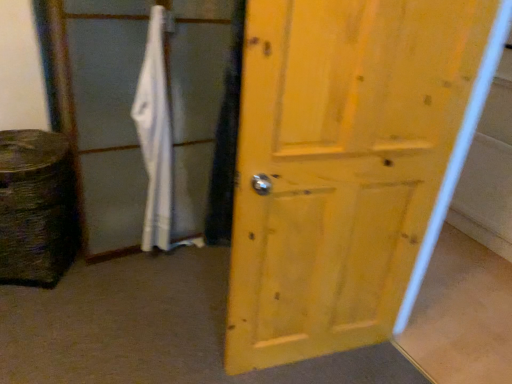
Question: From the image's perspective, is matte white screen door at center located beneath white fabric bath towel at center-left?

Choices:
 (A) no
 (B) yes

Answer: (A)

Question: Does matte white screen door at center lie behind white fabric bath towel at center-left?

Choices:
 (A) no
 (B) yes

Answer: (A)

Question: Is matte white screen door at center oriented away from white fabric bath towel at center-left?

Choices:
 (A) no
 (B) yes

Answer: (B)

Question: From a real-world perspective, is matte white screen door at center over white fabric bath towel at center-left?

Choices:
 (A) yes
 (B) no

Answer: (A)

Question: Considering the relative sizes of matte white screen door at center and white fabric bath towel at center-left in the image provided, is matte white screen door at center thinner than white fabric bath towel at center-left?

Choices:
 (A) no
 (B) yes

Answer: (A)

Question: Considering the positions of yellow wood door at center and matte white screen door at center in the image, is yellow wood door at center bigger or smaller than matte white screen door at center?

Choices:
 (A) big
 (B) small

Answer: (B)

Question: Considering the positions of yellow wood door at center and matte white screen door at center in the image, is yellow wood door at center wider or thinner than matte white screen door at center?

Choices:
 (A) thin
 (B) wide

Answer: (A)

Question: From the image's perspective, is yellow wood door at center positioned above or below matte white screen door at center?

Choices:
 (A) above
 (B) below

Answer: (B)

Question: Visually, is yellow wood door at center positioned to the left or to the right of matte white screen door at center?

Choices:
 (A) right
 (B) left

Answer: (A)

Question: Considering their positions, is white fabric bath towel at center-left located in front of or behind matte white screen door at center?

Choices:
 (A) behind
 (B) front

Answer: (A)

Question: From the image's perspective, is white fabric bath towel at center-left located above or below matte white screen door at center?

Choices:
 (A) below
 (B) above

Answer: (A)

Question: Is white fabric bath towel at center-left wider or thinner than matte white screen door at center?

Choices:
 (A) wide
 (B) thin

Answer: (B)

Question: Is white fabric bath towel at center-left bigger or smaller than matte white screen door at center?

Choices:
 (A) small
 (B) big

Answer: (A)

Question: Considering the positions of matte white screen door at center and white fabric bath towel at center-left in the image, is matte white screen door at center taller or shorter than white fabric bath towel at center-left?

Choices:
 (A) tall
 (B) short

Answer: (A)

Question: Based on their sizes in the image, would you say matte white screen door at center is bigger or smaller than white fabric bath towel at center-left?

Choices:
 (A) big
 (B) small

Answer: (A)